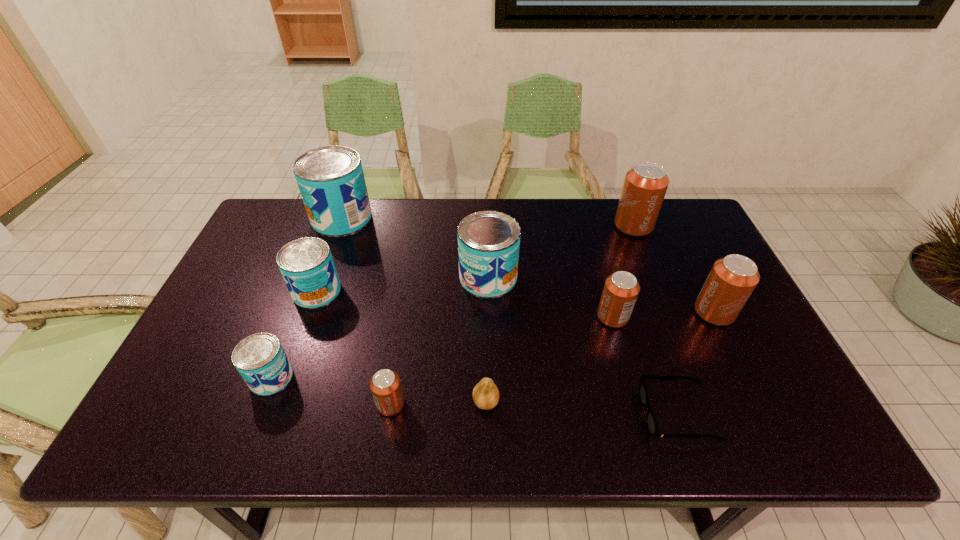
The height and width of the screenshot is (540, 960). What are the coordinates of `object that is the seventh closest to the second biggest blue can` in the screenshot? It's located at (651, 422).

This screenshot has height=540, width=960. Identify the location of object that is the second nearest to the second smallest blue can. (331, 181).

Point out which can is positioned as the sixth nearest to the smallest orange can. Please provide its 2D coordinates. Your answer should be formatted as a tuple, i.e. [(x, y)], where the tuple contains the x and y coordinates of a point satisfying the conditions above.

[(732, 279)]

Identify the location of can that is the fifth nearest to the pear. (306, 264).

Identify which blue can is located as the second nearest to the rightmost can. Please provide its 2D coordinates. Your answer should be formatted as a tuple, i.e. [(x, y)], where the tuple contains the x and y coordinates of a point satisfying the conditions above.

[(306, 264)]

What are the coordinates of `blue can that stands as the closest to the biggest blue can` in the screenshot? It's located at (306, 264).

You are a GUI agent. You are given a task and a screenshot of the screen. Output one action in this format:
    pyautogui.click(x=<x>, y=<y>)
    Task: Click on the orange can that is the third closest one to the rightmost can
    The height and width of the screenshot is (540, 960).
    Given the screenshot: What is the action you would take?
    pyautogui.click(x=385, y=385)

Locate an element on the screen. The height and width of the screenshot is (540, 960). the third closest orange can to the pear is located at coordinates (732, 279).

The image size is (960, 540). I want to click on vacant space that satisfies the following two spatial constraints: 1. on the front side of the pear; 2. on the right side of the second smallest blue can, so click(277, 402).